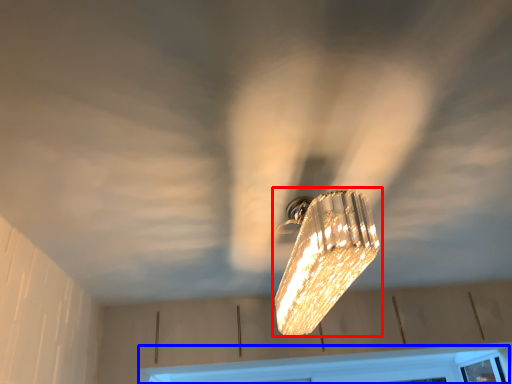
Question: Among these objects, which one is nearest to the camera, lamp (highlighted by a red box) or window frame (highlighted by a blue box)?

Choices:
 (A) lamp
 (B) window frame

Answer: (A)